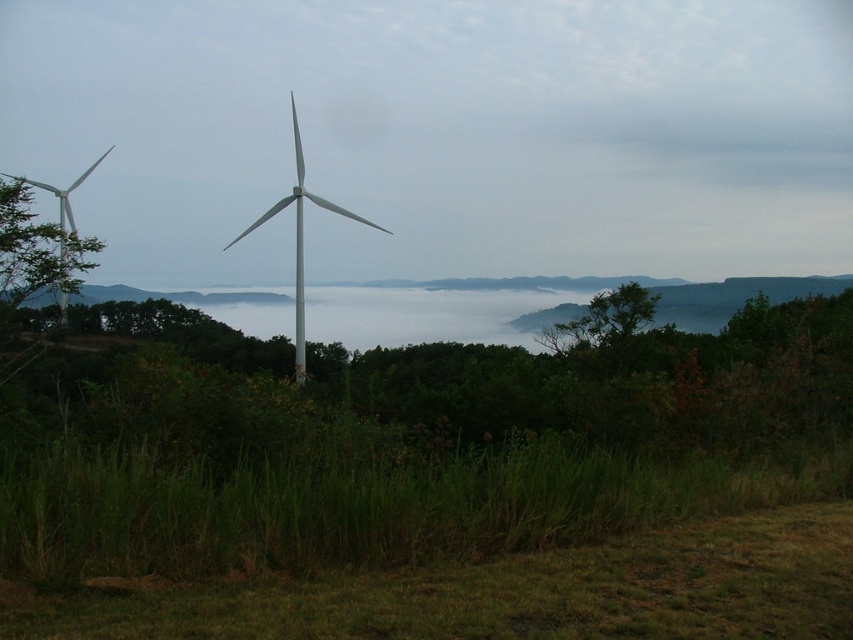
Question: Can you confirm if white matte wind turbine at center is smaller than white matte windmill at left?

Choices:
 (A) yes
 (B) no

Answer: (A)

Question: Does white matte wind turbine at center have a lesser width compared to white matte windmill at left?

Choices:
 (A) yes
 (B) no

Answer: (A)

Question: Is white matte wind turbine at center above white matte windmill at left?

Choices:
 (A) yes
 (B) no

Answer: (A)

Question: Among these objects, which one is nearest to the camera?

Choices:
 (A) white matte wind turbine at center
 (B) white matte windmill at left

Answer: (B)

Question: Which point appears closest to the camera in this image?

Choices:
 (A) (300, 260)
 (B) (24, 177)

Answer: (A)